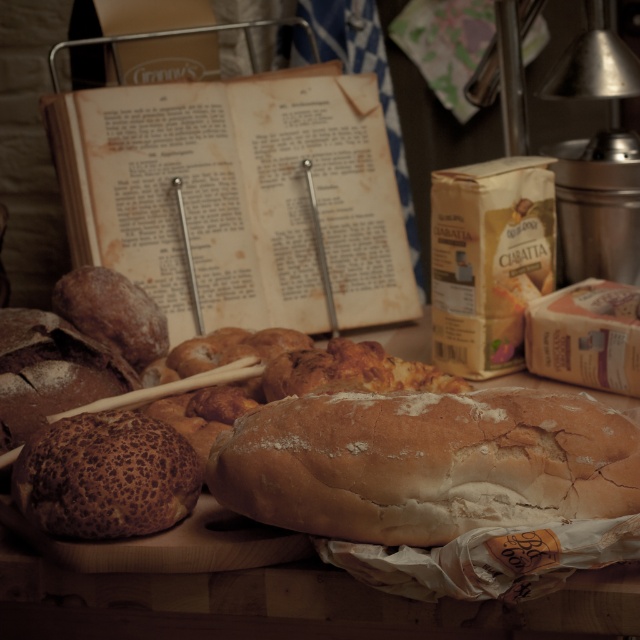
Question: Which object appears closest to the camera in this image?

Choices:
 (A) golden brown crusty loaf of bread at center
 (B) leopard-patterned crust at center

Answer: (A)

Question: Is golden brown crusty loaf of bread at center behind leopard-patterned crust at center?

Choices:
 (A) yes
 (B) no

Answer: (B)

Question: Is golden brown crusty loaf of bread at center further to the viewer compared to leopard-patterned crust at center?

Choices:
 (A) no
 (B) yes

Answer: (A)

Question: Can you confirm if golden brown crusty loaf of bread at center is smaller than leopard-patterned crust at center?

Choices:
 (A) no
 (B) yes

Answer: (A)